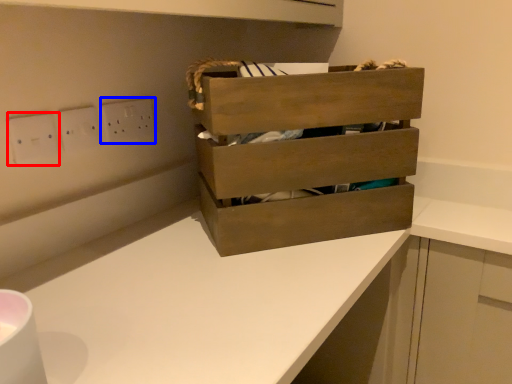
Question: Which of the following is the farthest to the observer, electric outlet (highlighted by a red box) or electric outlet (highlighted by a blue box)?

Choices:
 (A) electric outlet
 (B) electric outlet

Answer: (B)